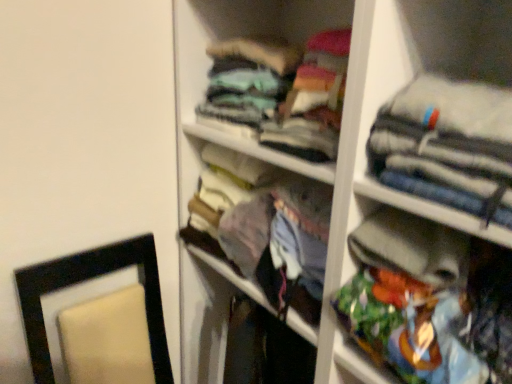
Where is `multicolored fabric bag at right, which is the first clothing from bottom to top`? The height and width of the screenshot is (384, 512). multicolored fabric bag at right, which is the first clothing from bottom to top is located at coordinates (423, 330).

In order to face gray fabric jacket at upper right, the second clothing positioned from the bottom, should I rotate leftwards or rightwards?

To face it directly, rotate right by 27.626 degrees.

Find the location of a particular element. This screenshot has height=384, width=512. teal fabric shirt at upper center, the first clothing from the top is located at coordinates (280, 93).

You are a GUI agent. You are given a task and a screenshot of the screen. Output one action in this format:
    pyautogui.click(x=<x>, y=<y>)
    Task: Click on the multicolored fabric bag at right, which is the 3th clothing from top to bottom
    The height and width of the screenshot is (384, 512).
    Given the screenshot: What is the action you would take?
    pyautogui.click(x=423, y=330)

From a real-world perspective, count 1st clothings upward from the multicolored fabric bag at right, which is the 3th clothing from top to bottom, and point to it. Please provide its 2D coordinates.

[(280, 93)]

In the scene shown: Is multicolored fabric bag at right, which is the first clothing from bottom to top, not inside teal fabric shirt at upper center, which is the third clothing from bottom to top?

Absolutely, multicolored fabric bag at right, which is the first clothing from bottom to top, is external to teal fabric shirt at upper center, which is the third clothing from bottom to top.

Which object is positioned more to the left, multicolored fabric bag at right, which is the 3th clothing from top to bottom, or teal fabric shirt at upper center, which is the third clothing from bottom to top?

teal fabric shirt at upper center, which is the third clothing from bottom to top, is more to the left.

In the scene shown: From a real-world perspective, who is located higher, multicolored fabric bag at right, which is the 3th clothing from top to bottom, or teal fabric shirt at upper center, which is the third clothing from bottom to top?

teal fabric shirt at upper center, which is the third clothing from bottom to top, from a real-world perspective.

The width and height of the screenshot is (512, 384). I want to click on clothing lying behind the multicolored fabric bag at right, which is the 3th clothing from top to bottom, so [x=280, y=93].

Considering the sizes of objects teal fabric shirt at upper center, the first clothing from the top, and multicolored fabric bag at right, which is the first clothing from bottom to top, in the image provided, who is bigger, teal fabric shirt at upper center, the first clothing from the top, or multicolored fabric bag at right, which is the first clothing from bottom to top,?

With larger size is teal fabric shirt at upper center, the first clothing from the top.

How different are the orientations of teal fabric shirt at upper center, which is the third clothing from bottom to top, and multicolored fabric bag at right, which is the 3th clothing from top to bottom, in degrees?

teal fabric shirt at upper center, which is the third clothing from bottom to top, and multicolored fabric bag at right, which is the 3th clothing from top to bottom, are facing 2.75 degrees away from each other.

Is teal fabric shirt at upper center, which is the third clothing from bottom to top, outside of multicolored fabric bag at right, which is the first clothing from bottom to top?

Absolutely, teal fabric shirt at upper center, which is the third clothing from bottom to top, is external to multicolored fabric bag at right, which is the first clothing from bottom to top.

Is teal fabric shirt at upper center, the first clothing from the top, far away from gray fabric jacket at upper right, which is the 2th clothing from top to bottom?

No, teal fabric shirt at upper center, the first clothing from the top, is not far from gray fabric jacket at upper right, which is the 2th clothing from top to bottom.

I want to click on the 1st clothing counting from the right side of the teal fabric shirt at upper center, the first clothing from the top, so click(x=448, y=145).

Is teal fabric shirt at upper center, the first clothing from the top, inside or outside of gray fabric jacket at upper right, which is the 2th clothing from top to bottom?

teal fabric shirt at upper center, the first clothing from the top, is located beyond the bounds of gray fabric jacket at upper right, which is the 2th clothing from top to bottom.

From the picture: Is teal fabric shirt at upper center, the first clothing from the top, oriented towards gray fabric jacket at upper right, which is the 2th clothing from top to bottom?

No, teal fabric shirt at upper center, the first clothing from the top, does not turn towards gray fabric jacket at upper right, which is the 2th clothing from top to bottom.

Which point is more forward, (403,132) or (450,348)?

Positioned in front is point (403,132).

Is gray fabric jacket at upper right, which is the 2th clothing from top to bottom, touching multicolored fabric bag at right, which is the first clothing from bottom to top?

No, gray fabric jacket at upper right, which is the 2th clothing from top to bottom, is not with multicolored fabric bag at right, which is the first clothing from bottom to top.

Is gray fabric jacket at upper right, which is the 2th clothing from top to bottom, facing towards multicolored fabric bag at right, which is the first clothing from bottom to top?

No, gray fabric jacket at upper right, which is the 2th clothing from top to bottom, is not oriented towards multicolored fabric bag at right, which is the first clothing from bottom to top.

Is the position of gray fabric jacket at upper right, the second clothing positioned from the bottom, more distant than that of multicolored fabric bag at right, which is the first clothing from bottom to top?

No, it is in front of multicolored fabric bag at right, which is the first clothing from bottom to top.

Which of these two, gray fabric jacket at upper right, the second clothing positioned from the bottom, or teal fabric shirt at upper center, which is the third clothing from bottom to top, is smaller?

Smaller between the two is gray fabric jacket at upper right, the second clothing positioned from the bottom.

In the scene shown: What's the angular difference between gray fabric jacket at upper right, which is the 2th clothing from top to bottom, and teal fabric shirt at upper center, the first clothing from the top,'s facing directions?

The angle between the facing direction of gray fabric jacket at upper right, which is the 2th clothing from top to bottom, and the facing direction of teal fabric shirt at upper center, the first clothing from the top, is 2.75 degrees.

In the scene shown: From the image's perspective, between gray fabric jacket at upper right, the second clothing positioned from the bottom, and teal fabric shirt at upper center, the first clothing from the top, who is located below?

gray fabric jacket at upper right, the second clothing positioned from the bottom, is shown below in the image.

Between gray fabric jacket at upper right, which is the 2th clothing from top to bottom, and teal fabric shirt at upper center, which is the third clothing from bottom to top, which one has smaller width?

Thinner between the two is gray fabric jacket at upper right, which is the 2th clothing from top to bottom.

Is point (500, 342) closer or farther from the camera than point (507, 202)?

Point (500, 342) is positioned farther from the camera compared to point (507, 202).

Which object is positioned more to the right, multicolored fabric bag at right, which is the first clothing from bottom to top, or gray fabric jacket at upper right, which is the 2th clothing from top to bottom?

multicolored fabric bag at right, which is the first clothing from bottom to top.

From their relative heights in the image, would you say multicolored fabric bag at right, which is the first clothing from bottom to top, is taller or shorter than gray fabric jacket at upper right, the second clothing positioned from the bottom?

Considering their sizes, multicolored fabric bag at right, which is the first clothing from bottom to top, has more height than gray fabric jacket at upper right, the second clothing positioned from the bottom.

Is multicolored fabric bag at right, which is the 3th clothing from top to bottom, behind gray fabric jacket at upper right, which is the 2th clothing from top to bottom?

Yes, the depth of multicolored fabric bag at right, which is the 3th clothing from top to bottom, is greater than that of gray fabric jacket at upper right, which is the 2th clothing from top to bottom.

In order to click on clothing below the teal fabric shirt at upper center, which is the third clothing from bottom to top (from a real-world perspective) in this screenshot , I will do point(423,330).

I want to click on clothing lying behind the multicolored fabric bag at right, which is the first clothing from bottom to top, so click(x=280, y=93).

Based on their spatial positions, is multicolored fabric bag at right, which is the first clothing from bottom to top, or teal fabric shirt at upper center, which is the third clothing from bottom to top, further from gray fabric jacket at upper right, which is the 2th clothing from top to bottom?

teal fabric shirt at upper center, which is the third clothing from bottom to top.

Consider the image. Looking at the image, which one is located further to multicolored fabric bag at right, which is the first clothing from bottom to top, teal fabric shirt at upper center, which is the third clothing from bottom to top, or gray fabric jacket at upper right, the second clothing positioned from the bottom?

teal fabric shirt at upper center, which is the third clothing from bottom to top, is positioned further to the anchor multicolored fabric bag at right, which is the first clothing from bottom to top.

Looking at the image, which one is located further to gray fabric jacket at upper right, which is the 2th clothing from top to bottom, teal fabric shirt at upper center, which is the third clothing from bottom to top, or multicolored fabric bag at right, which is the 3th clothing from top to bottom?

teal fabric shirt at upper center, which is the third clothing from bottom to top, lies further to gray fabric jacket at upper right, which is the 2th clothing from top to bottom, than the other object.

Considering their positions, is multicolored fabric bag at right, which is the 3th clothing from top to bottom, positioned closer to teal fabric shirt at upper center, which is the third clothing from bottom to top, than gray fabric jacket at upper right, the second clothing positioned from the bottom?

gray fabric jacket at upper right, the second clothing positioned from the bottom, is closer to teal fabric shirt at upper center, which is the third clothing from bottom to top.

Looking at the image, which one is located closer to teal fabric shirt at upper center, the first clothing from the top, gray fabric jacket at upper right, the second clothing positioned from the bottom, or multicolored fabric bag at right, which is the 3th clothing from top to bottom?

Among the two, gray fabric jacket at upper right, the second clothing positioned from the bottom, is located nearer to teal fabric shirt at upper center, the first clothing from the top.

Estimate the real-world distances between objects in this image. Which object is further from multicolored fabric bag at right, which is the 3th clothing from top to bottom, gray fabric jacket at upper right, which is the 2th clothing from top to bottom, or teal fabric shirt at upper center, the first clothing from the top?

teal fabric shirt at upper center, the first clothing from the top.

Identify the location of clothing between teal fabric shirt at upper center, which is the third clothing from bottom to top, and multicolored fabric bag at right, which is the first clothing from bottom to top, in the vertical direction. pos(448,145).